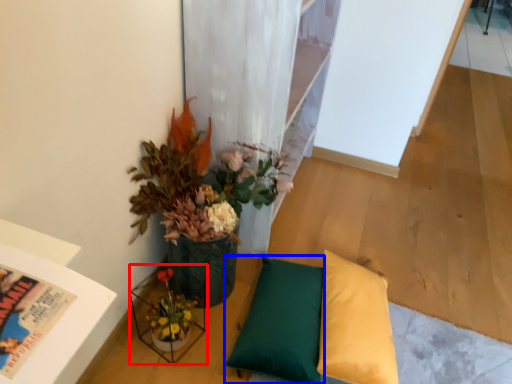
Question: Which of the following is the closest to the observer, vase (highlighted by a red box) or pillow (highlighted by a blue box)?

Choices:
 (A) vase
 (B) pillow

Answer: (A)